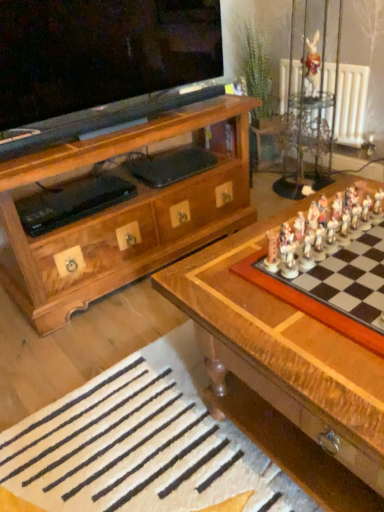
At what (x,y) coordinates should I click in order to perform the action: click on empty space that is ontop of white wool rug at lower center. Please return your answer as a coordinate pair (x, y). The height and width of the screenshot is (512, 384). Looking at the image, I should click on (140, 445).